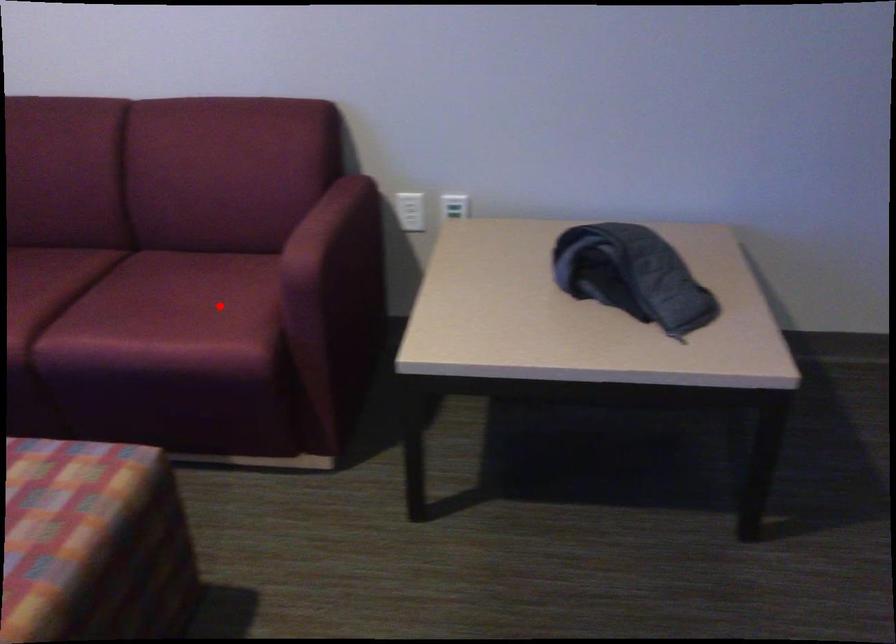
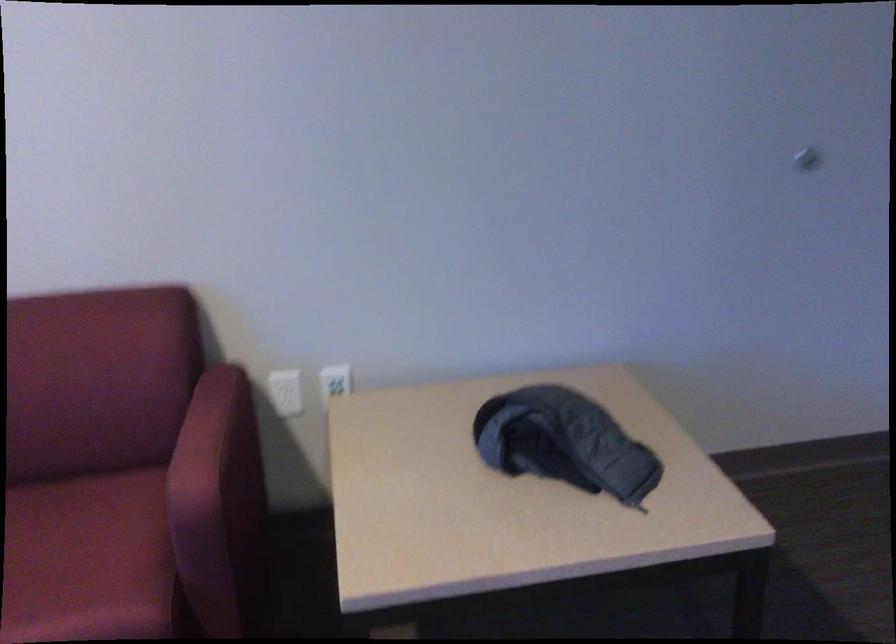
Question: I am providing you with two images of the same scene from different viewpoints. A red point is shown in image1. For the corresponding object point in image2, is it positioned nearer or farther from the camera?

Choices:
 (A) Nearer
 (B) Farther

Answer: (A)